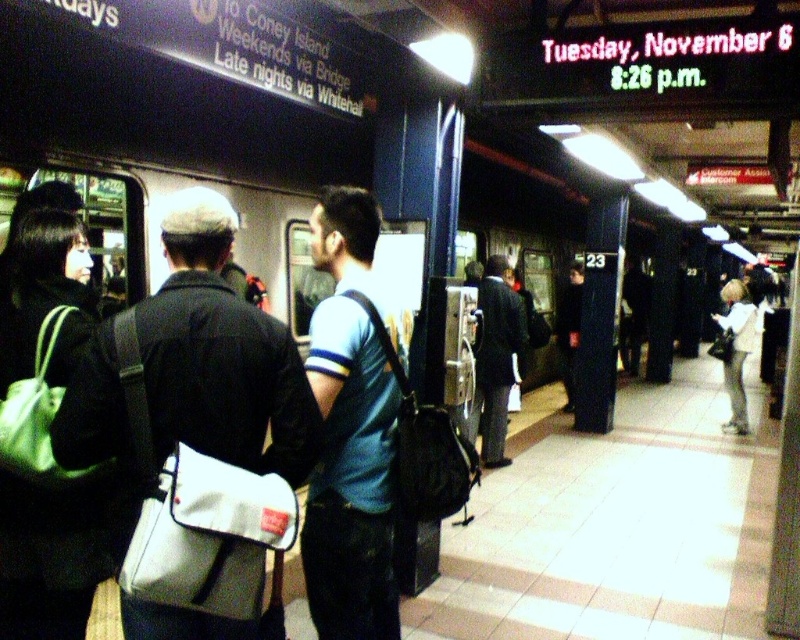
Does white fabric bag at center appear on the right side of light beige jacket at right?

Answer: Incorrect, white fabric bag at center is not on the right side of light beige jacket at right.

Is white fabric bag at center wider than light beige jacket at right?

In fact, white fabric bag at center might be narrower than light beige jacket at right.

Who is more forward, (277, 336) or (730, 387)?

Point (277, 336) is more forward.

Identify the location of white fabric bag at center. (220, 355).

In the scene shown: Which is more to the left, blue fabric backpack at center or dark blue suit at center?

From the viewer's perspective, blue fabric backpack at center appears more on the left side.

Between blue fabric backpack at center and dark blue suit at center, which one has more height?

Standing taller between the two is dark blue suit at center.

Based on the photo, who is more forward, [329,433] or [504,401]?

Positioned in front is point [329,433].

The height and width of the screenshot is (640, 800). I want to click on blue fabric backpack at center, so click(x=350, y=432).

Which is below, white fabric bag at center or blue fabric backpack at center?

blue fabric backpack at center is below.

Is white fabric bag at center taller than blue fabric backpack at center?

In fact, white fabric bag at center may be shorter than blue fabric backpack at center.

Is point (184, 381) closer to camera compared to point (326, 205)?

Yes, point (184, 381) is in front of point (326, 205).

I want to click on white fabric bag at center, so click(x=220, y=355).